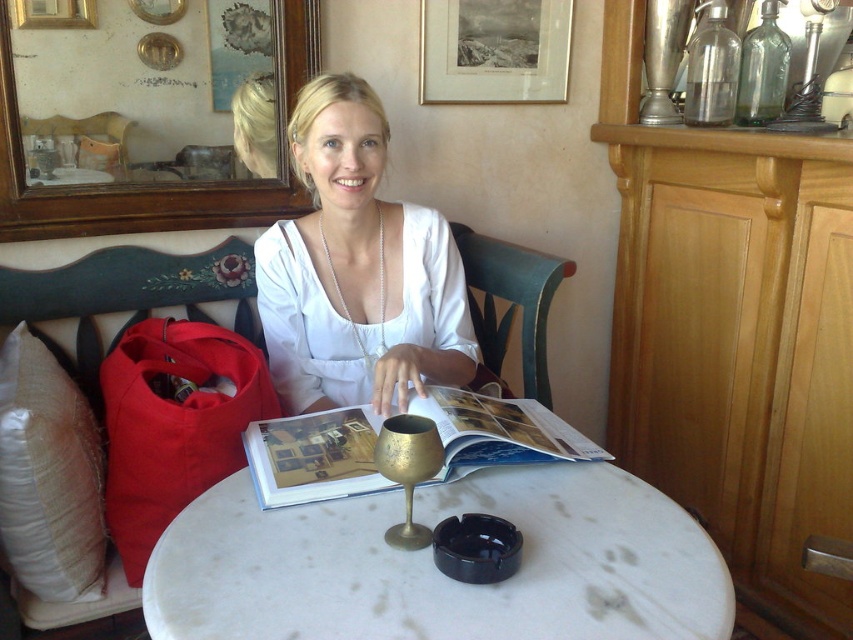
Which is in front, point (596, 572) or point (4, 240)?

Point (596, 572) is in front.

Identify the location of white marble table at center. This screenshot has width=853, height=640. pyautogui.click(x=436, y=570).

Is the position of gold-framed print at upper center less distant than that of gold metallic wine glass at center?

That is False.

Is point (439, 68) closer to camera compared to point (383, 468)?

No.

Measure the distance between point (521,83) and camera.

Point (521,83) is 1.96 meters from camera.

The width and height of the screenshot is (853, 640). What are the coordinates of `gold-framed print at upper center` in the screenshot? It's located at (494, 51).

Between point (299, 484) and point (434, 0), which one is positioned behind?

The point (434, 0) is behind.

Which is in front, point (579, 451) or point (517, 28)?

Point (579, 451) is more forward.

Is point (508, 404) less distant than point (549, 51)?

Yes.

Locate an element on the screen. Image resolution: width=853 pixels, height=640 pixels. matte gold magazine at center is located at coordinates (314, 456).